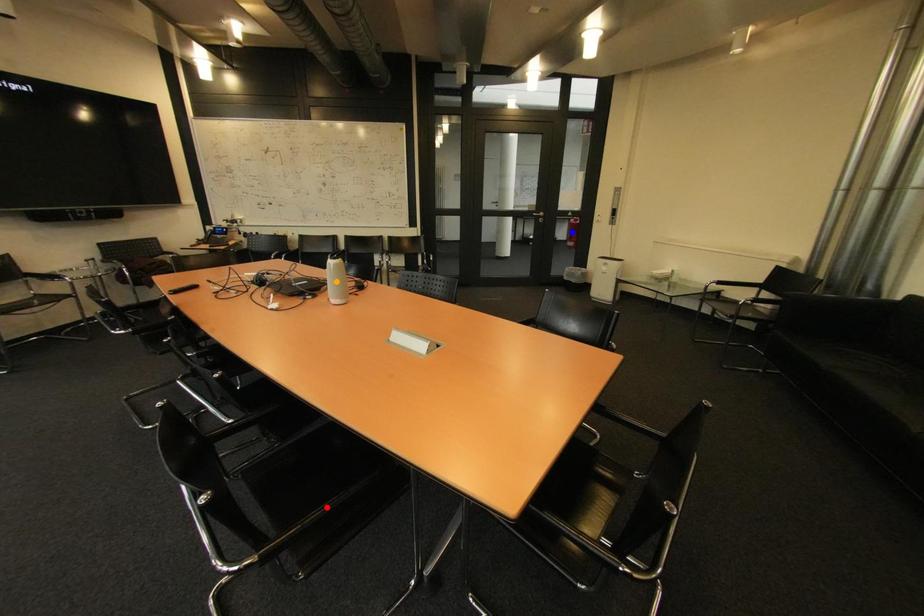
Order these from nearest to farthest:
blue point, orange point, red point

blue point → orange point → red point